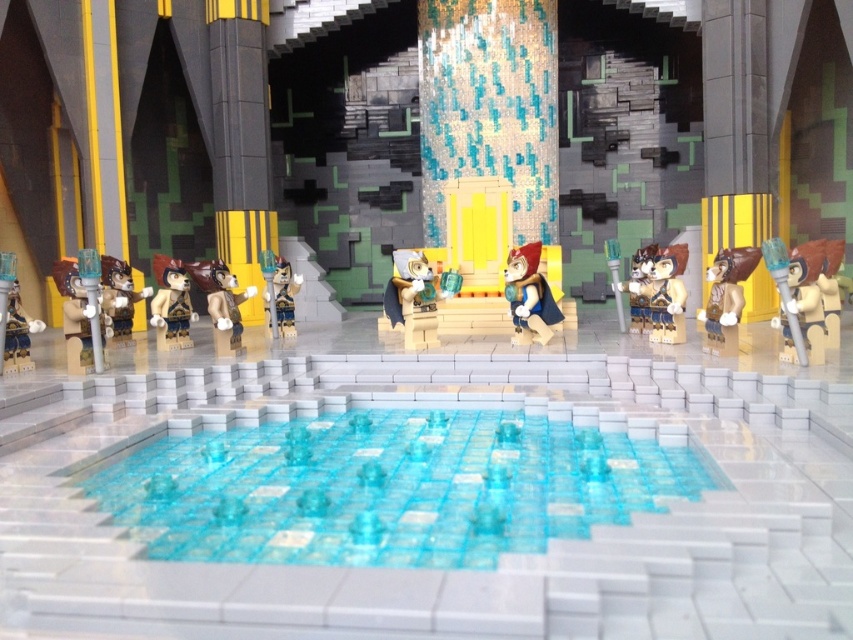
Question: Among these objects, which one is nearest to the camera?

Choices:
 (A) matte brown minifigure at right
 (B) brown matte figure at left
 (C) matte black minifigure at left
 (D) brown matte figure at right

Answer: (C)

Question: Can you confirm if brown matte figure at right is thinner than matte gray fur at center?

Choices:
 (A) no
 (B) yes

Answer: (A)

Question: Is transparent plastic water at center positioned in front of matte black minifigure at left?

Choices:
 (A) yes
 (B) no

Answer: (A)

Question: Can you confirm if shiny blue cape at center is wider than brown matte figure at left?

Choices:
 (A) yes
 (B) no

Answer: (A)

Question: Which point is farther to the camera?

Choices:
 (A) (68, 312)
 (B) (3, 356)
 (C) (213, 284)
 (D) (267, 317)

Answer: (D)

Question: Which of the following is the farthest from the observer?

Choices:
 (A) matte brown minifigure at right
 (B) brown matte figure at center
 (C) shiny blue cape at center

Answer: (C)